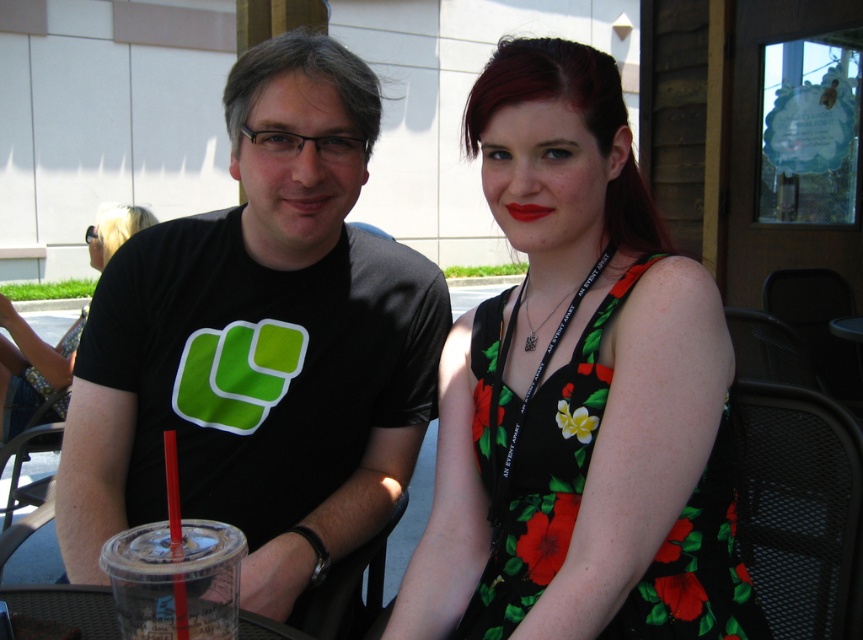
In the scene shown: You are standing at the origin of the coordinate system. There is a point at coordinate point (30,368). Which object is located at that point?

The point (30,368) corresponds to the black floral dress at center.

You are standing in front of the image and want to locate the floral print fabric dress at center. Please provide its 2D coordinates based on the image coordinate system where the origin is at the bottom left corner.

The 2D coordinates of the floral print fabric dress at center are at point (533, 458).